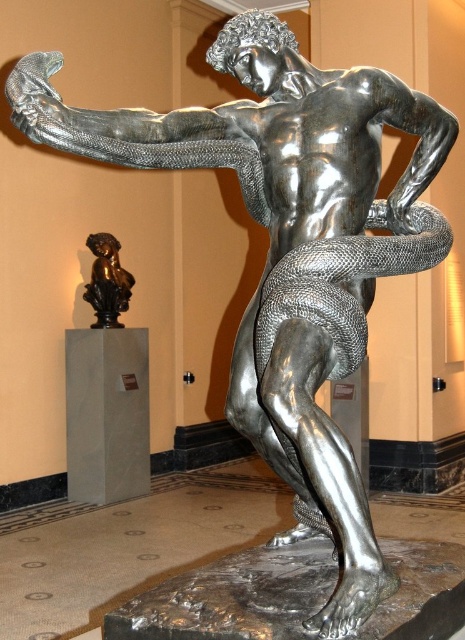
You are standing in the center of the room and want to move towards the white marble pillar at lower left. In which direction should you walk?

You should walk towards the lower left direction to reach the white marble pillar at lower left.